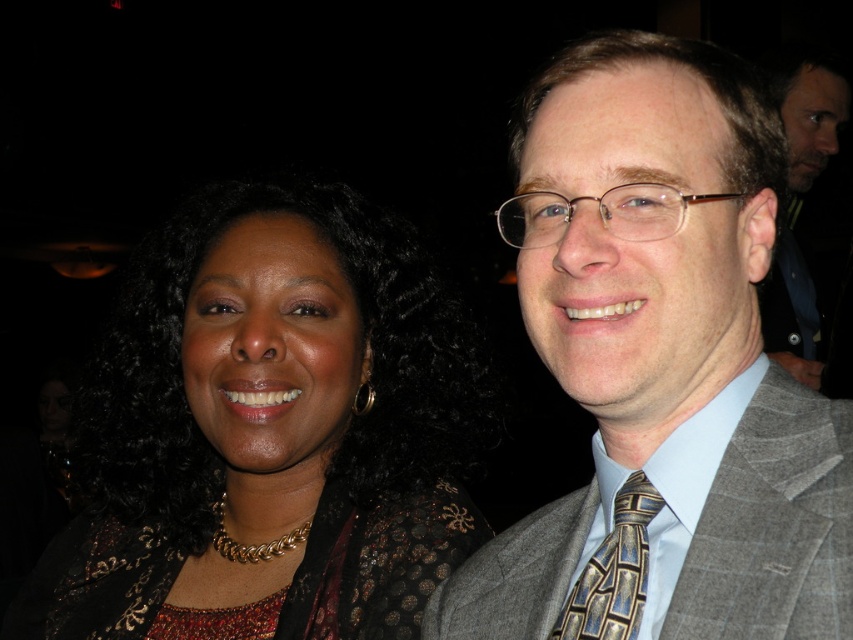
Question: Is gold beaded necklace at center further to the viewer compared to gray wool suit at right?

Choices:
 (A) yes
 (B) no

Answer: (A)

Question: Considering the real-world distances, which object is farthest from the gold-patterned tie at right?

Choices:
 (A) gray wool suit at right
 (B) gray textured suit at center

Answer: (B)

Question: Does gold beaded necklace at center have a smaller size compared to gold-patterned tie at right?

Choices:
 (A) no
 (B) yes

Answer: (A)

Question: Which object appears closest to the camera in this image?

Choices:
 (A) gray textured suit at center
 (B) gray textured suit at right
 (C) gray wool suit at right
 (D) gold beaded necklace at center

Answer: (A)

Question: Where is gray textured suit at right located in relation to gold-patterned tie at right in the image?

Choices:
 (A) above
 (B) below

Answer: (A)

Question: Which object appears farthest from the camera in this image?

Choices:
 (A) gray textured suit at right
 (B) gray wool suit at right

Answer: (A)